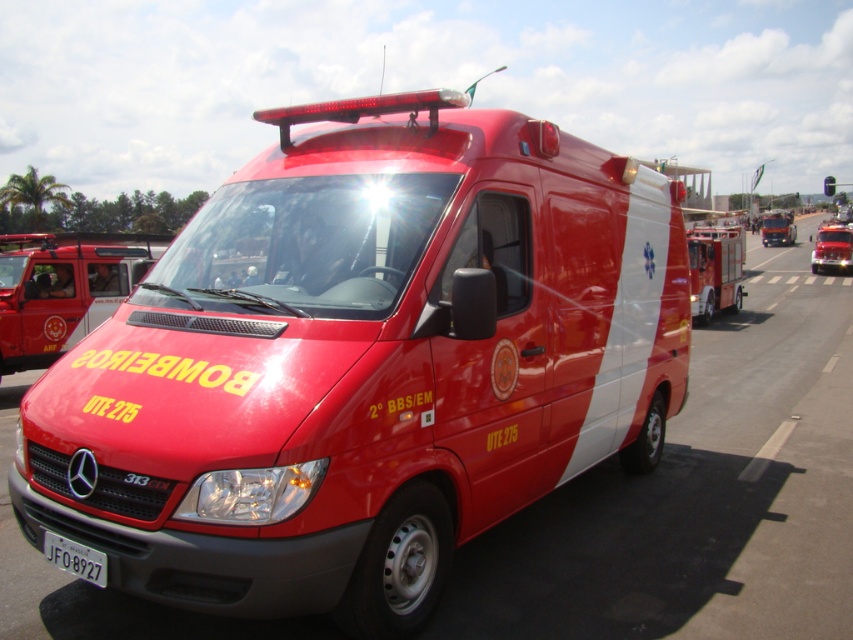
You are a photographer trying to capture the shiny red fire truck at left and the white plastic license plate at lower center in the same frame. Since the fire truck is taller, will you need to adjust your camera angle to focus on the license plate?

The shiny red fire truck at left is taller than the white plastic license plate at lower center. To focus on the license plate, you might need to lower your camera angle slightly to ensure it is visible and in focus alongside the taller fire truck.

You are a pedestrian standing in front of the shiny red van at center and the shiny red fire truck at left. Which vehicle is closer to the right edge of the image?

The shiny red van at center is positioned on the right side of the shiny red fire truck at left, so it is closer to the right edge of the image.

You are a firefighter standing at the front of the fire truck and need to reach a point marked on your map. The coordinates given are point 1 at (62, 262) and point 2 at (74, 568). Which point is closer to you?

Point 2 at (74, 568) is closer to you because it is in front of point 1 at (62, 262).